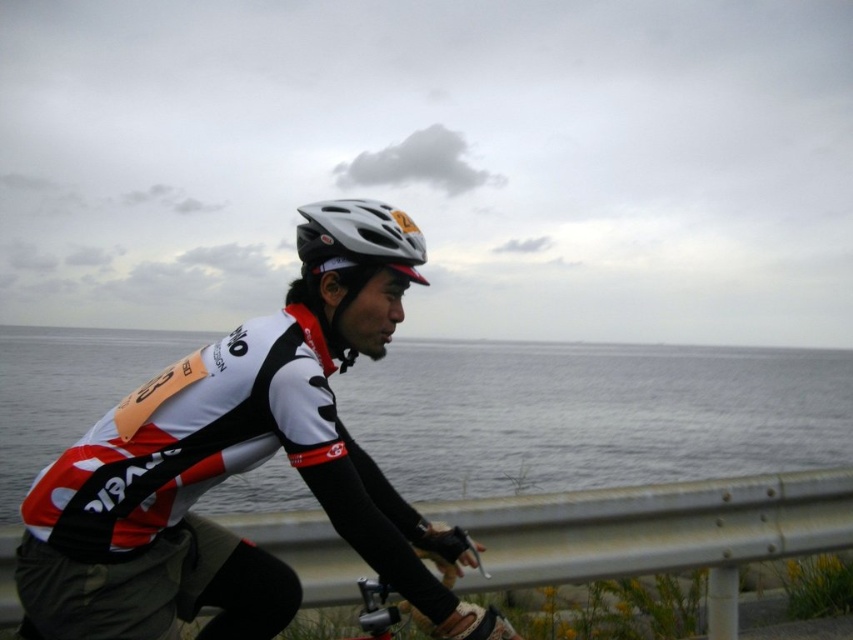
You are a photographer trying to capture the cyclist and the bicycle in the frame. Given that the transparent water at center takes up more space than the metallic silver bicycle at lower center, how does the size of the bicycle compare to the water area in the image?

The transparent water at center is larger in size than the metallic silver bicycle at lower center, so the metallic silver bicycle at lower center appears smaller in the image compared to the transparent water at center.

You are a photographer trying to capture the cyclist and their gear. You want to ensure both the white matte bicycle helmet at center and the metallic silver bicycle at lower center are clearly visible in your shot. Given their sizes, which object should you focus on first to ensure it doesn

The white matte bicycle helmet at center has a smaller size compared to the metallic silver bicycle at lower center, so you should focus on the metallic silver bicycle at lower center first since it is larger and more likely to be in frame without needing adjustment.